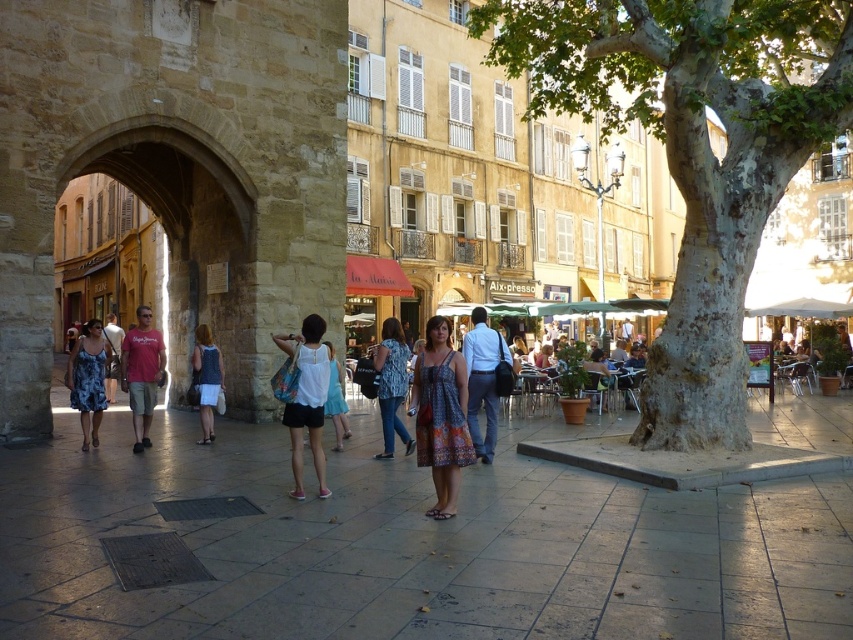
Does white fabric bag at center have a lesser width compared to denim jeans at center?

In fact, white fabric bag at center might be wider than denim jeans at center.

Image resolution: width=853 pixels, height=640 pixels. Find the location of `white fabric bag at center`. white fabric bag at center is located at coordinates (306, 397).

Identify the location of white fabric bag at center. This screenshot has width=853, height=640. (306, 397).

Can you confirm if smooth stone pavement at center is positioned above blue floral dress at left?

No.

Is smooth stone pavement at center to the right of blue floral dress at left from the viewer's perspective?

Correct, you'll find smooth stone pavement at center to the right of blue floral dress at left.

This screenshot has width=853, height=640. I want to click on smooth stone pavement at center, so click(413, 545).

Does dress at center have a greater height compared to denim dress at center?

Indeed, dress at center has a greater height compared to denim dress at center.

Does dress at center appear on the left side of denim dress at center?

Incorrect, dress at center is not on the left side of denim dress at center.

You are a GUI agent. You are given a task and a screenshot of the screen. Output one action in this format:
    pyautogui.click(x=<x>, y=<y>)
    Task: Click on the dress at center
    
    Given the screenshot: What is the action you would take?
    tap(440, 416)

Identify the location of dress at center. This screenshot has height=640, width=853. (440, 416).